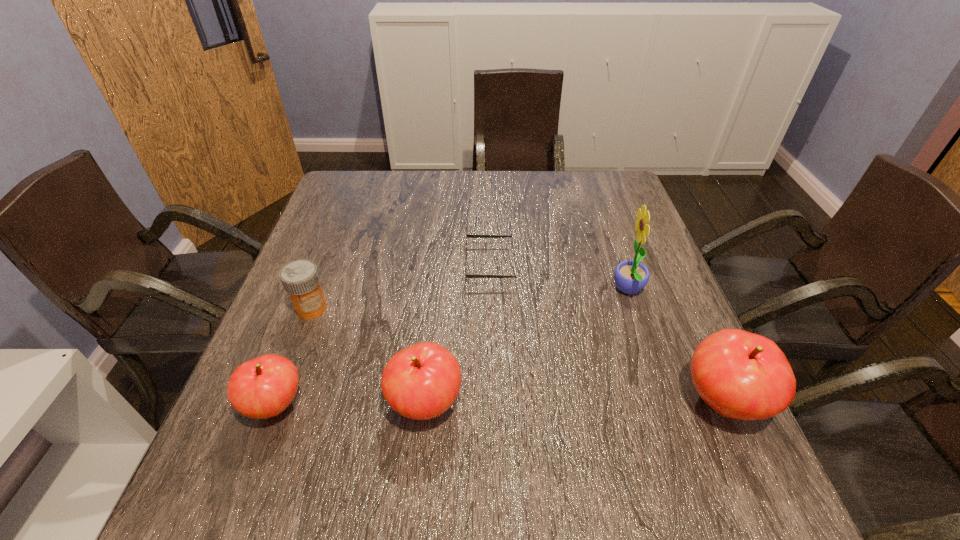
Identify the location of vacant space situated on the front-facing side of the shortest object. (309, 265).

Identify the location of vacant point located on the front-facing side of the shortest object. This screenshot has width=960, height=540. (388, 265).

Image resolution: width=960 pixels, height=540 pixels. Find the location of `free location located on the front-facing side of the shortest object`. free location located on the front-facing side of the shortest object is located at coordinates (369, 265).

Find the location of a particular element. vacant area situated 0.090m on the label side of the medicine is located at coordinates (295, 353).

This screenshot has width=960, height=540. I want to click on free space located on the front-facing side of the sunflower, so pyautogui.click(x=566, y=291).

Where is `free location located 0.270m on the front-facing side of the sunflower`? The width and height of the screenshot is (960, 540). free location located 0.270m on the front-facing side of the sunflower is located at coordinates (499, 291).

I want to click on vacant area located on the front-facing side of the sunflower, so click(x=541, y=291).

In order to click on apple present at the left edge in this screenshot , I will do click(x=263, y=387).

At what (x,y) coordinates should I click in order to perform the action: click on medicine situated at the left edge. Please return your answer as a coordinate pair (x, y). This screenshot has width=960, height=540. Looking at the image, I should click on (300, 278).

I want to click on apple present at the right edge, so click(741, 375).